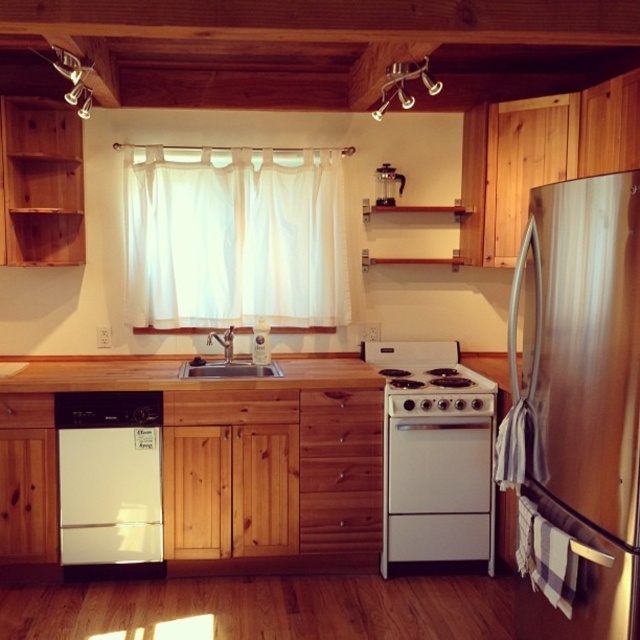
Is point (545, 381) closer to camera compared to point (180, 372)?

Yes, it is in front of point (180, 372).

Which is behind, point (554, 282) or point (227, 364)?

The point (227, 364) is behind.

The width and height of the screenshot is (640, 640). What do you see at coordinates (582, 392) in the screenshot?
I see `stainless steel refrigerator at right` at bounding box center [582, 392].

This screenshot has height=640, width=640. What are the coordinates of `stainless steel refrigerator at right` in the screenshot? It's located at (582, 392).

Between point (624, 540) and point (163, 378), which one is positioned in front?

Point (624, 540)

Between stainless steel refrigerator at right and wooden countertop at center, which one appears on the right side from the viewer's perspective?

stainless steel refrigerator at right

You are a GUI agent. You are given a task and a screenshot of the screen. Output one action in this format:
    pyautogui.click(x=<x>, y=<y>)
    Task: Click on the stainless steel refrigerator at right
    The height and width of the screenshot is (640, 640).
    Given the screenshot: What is the action you would take?
    pyautogui.click(x=582, y=392)

Which is behind, point (132, 284) or point (468, 444)?

Point (132, 284)

Consider the image. Which of these two, white sheer curtain at center or white matte oven at center, stands taller?

white sheer curtain at center

Is point (145, 268) positioned in front of point (413, 458)?

No, (145, 268) is further to viewer.

You are a GUI agent. You are given a task and a screenshot of the screen. Output one action in this format:
    pyautogui.click(x=<x>, y=<y>)
    Task: Click on the white sheer curtain at center
    This screenshot has width=640, height=640.
    Given the screenshot: What is the action you would take?
    pyautogui.click(x=234, y=236)